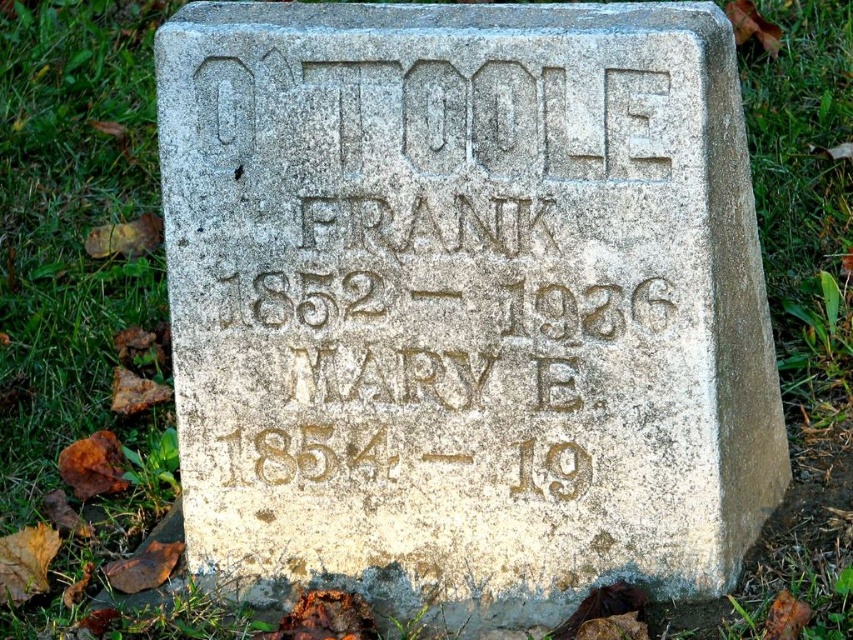
Question: Where is gray stone gravestone at center located in relation to carved stone inscription at center in the image?

Choices:
 (A) above
 (B) below

Answer: (A)

Question: Does gray stone gravestone at center have a lesser width compared to carved stone inscription at center?

Choices:
 (A) yes
 (B) no

Answer: (B)

Question: Can you confirm if gray stone gravestone at center is positioned above carved stone inscription at center?

Choices:
 (A) no
 (B) yes

Answer: (B)